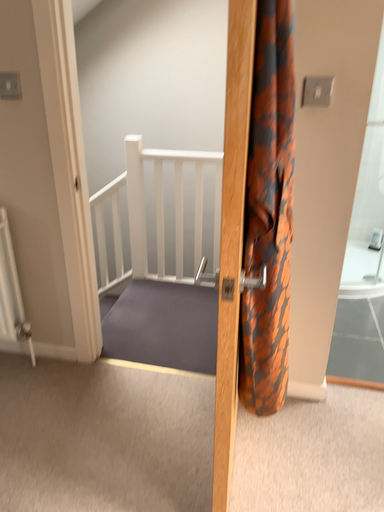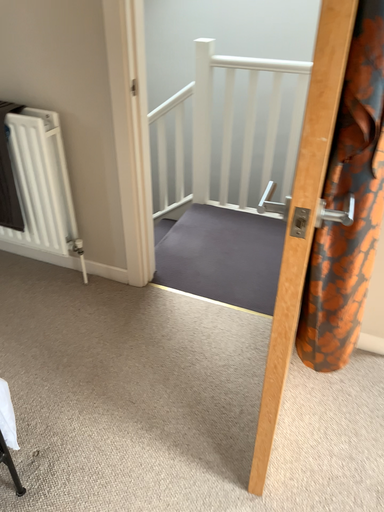
Question: How did the camera likely rotate when shooting the video?

Choices:
 (A) rotated left
 (B) rotated right

Answer: (A)